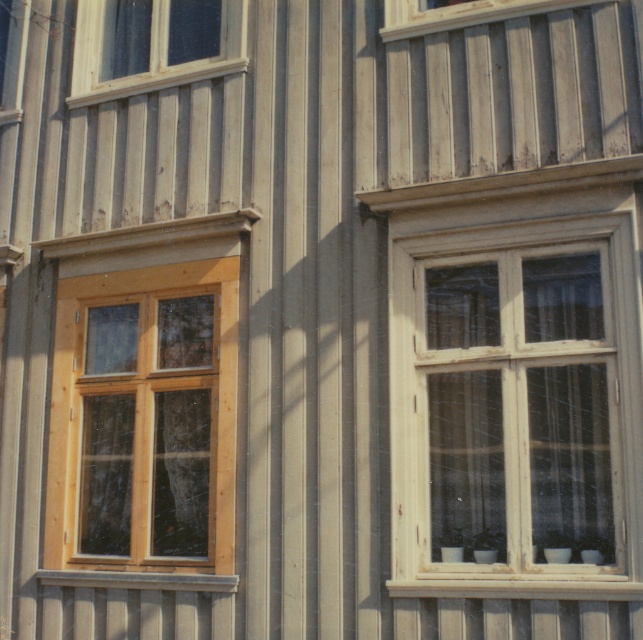
Does wooden window at center appear under natural wood window at left?

Actually, wooden window at center is above natural wood window at left.

Is point (550, 451) positioned before point (221, 294)?

Yes, it is in front of point (221, 294).

Does point (480, 496) come in front of point (150, 566)?

Yes, it is.

I want to click on wooden window at center, so click(x=516, y=401).

Does wooden window at upper center have a greater width compared to wooden window at upper left?

Yes, wooden window at upper center is wider than wooden window at upper left.

Is point (489, 20) positioned behind point (15, 51)?

No, it is not.

Identify the location of wooden window at upper center. The width and height of the screenshot is (643, 640). (460, 13).

Describe the element at coordinates (145, 426) in the screenshot. The width and height of the screenshot is (643, 640). I see `natural wood window at left` at that location.

Does natural wood window at left appear on the left side of wooden window at upper center?

Indeed, natural wood window at left is positioned on the left side of wooden window at upper center.

Find the location of a particular element. Image resolution: width=643 pixels, height=640 pixels. natural wood window at left is located at coordinates (145, 426).

Identify the location of natural wood window at left. The image size is (643, 640). (145, 426).